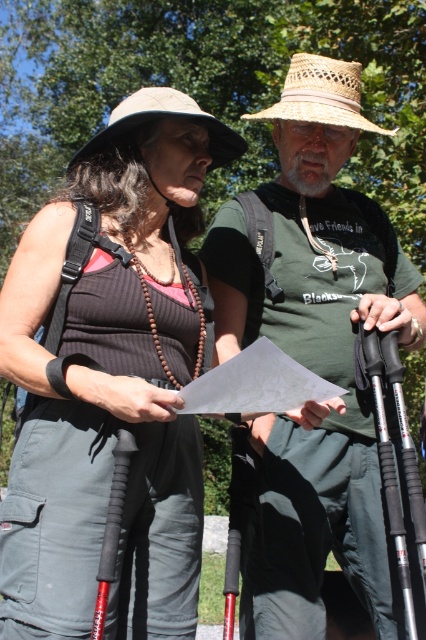
You are planning to take a photo of the two hikers. The photographer wants to ensure that both the green cotton shirt at center and the woven straw hat at upper center are clearly visible in the frame. Based on their positions, which object should be positioned closer to the bottom of the photo to achieve this?

The green cotton shirt at center should be positioned closer to the bottom of the photo because it is located below the woven straw hat at upper center. This arrangement ensures both objects are visible without one blocking the other.

You are a hiker who wants to locate the matte black vest at center in the image. Based on the coordinates provided, where should you look?

The matte black vest at center is located at the 2D coordinates point (112, 381), so you should look there.